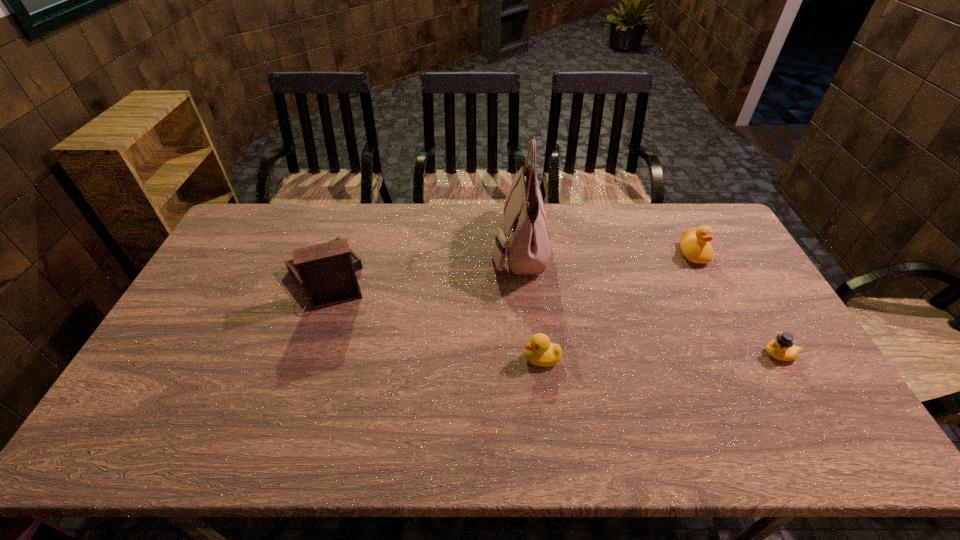
Identify which duck is the closest to the second duck from right to left. Please provide its 2D coordinates. Your answer should be formatted as a tuple, i.e. [(x, y)], where the tuple contains the x and y coordinates of a point satisfying the conditions above.

[(782, 348)]

At what (x,y) coordinates should I click in order to perform the action: click on blank area in the image that satisfies the following two spatial constraints: 1. on the side of the tallest object with the attached pouch; 2. on the front side of the fourth shortest object. Please return your answer as a coordinate pair (x, y). The image size is (960, 540). Looking at the image, I should click on (521, 279).